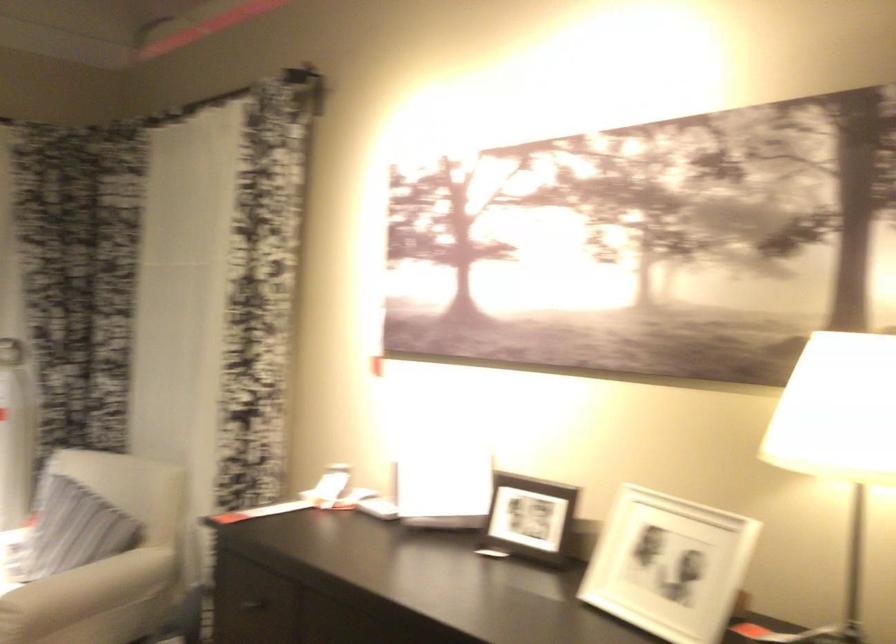
Locate an element on the screen. white chair armrest is located at coordinates point(85,592).